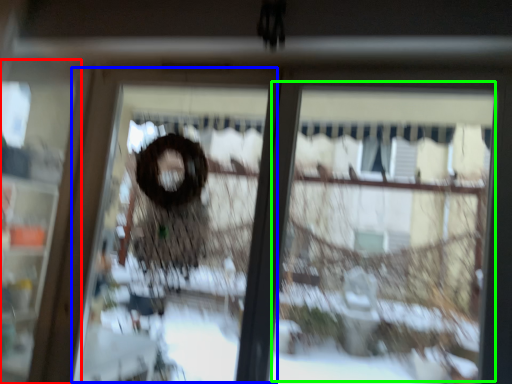
Question: Estimate the real-world distances between objects in this image. Which object is closer to screen door (highlighted by a red box), screen door (highlighted by a blue box) or shop window (highlighted by a green box)?

Choices:
 (A) screen door
 (B) shop window

Answer: (A)